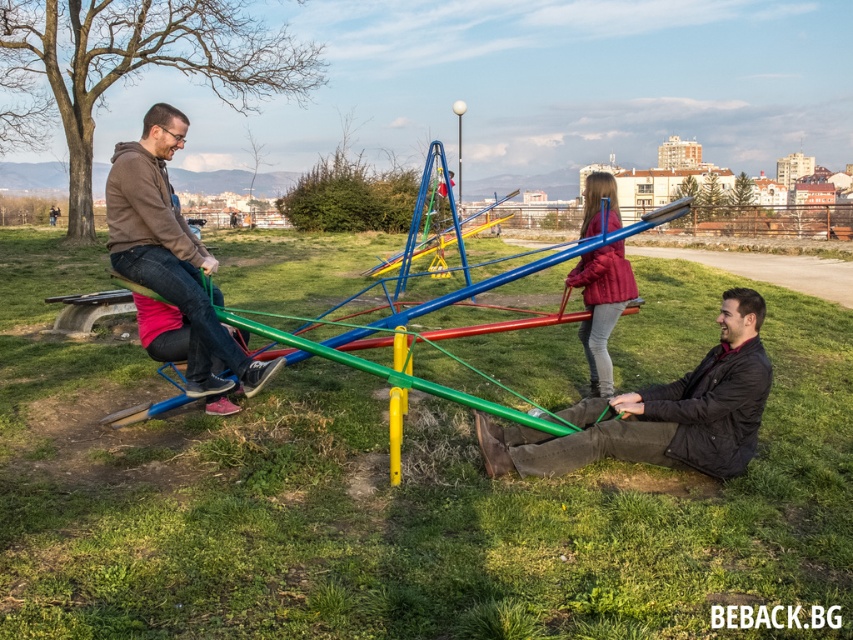
Between black leather jacket at lower right and metallic blue pole at center, which one is positioned lower?

black leather jacket at lower right

Who is higher up, black leather jacket at lower right or metallic blue pole at center?

metallic blue pole at center is above.

Between point (718, 353) and point (462, 104), which one is positioned behind?

The point (462, 104) is more distant.

Find the location of `black leather jacket at lower right`. black leather jacket at lower right is located at coordinates (659, 412).

Can you confirm if matte brown jacket at left is bigger than metallic blue pole at center?

No, matte brown jacket at left is not bigger than metallic blue pole at center.

What do you see at coordinates (172, 257) in the screenshot? I see `matte brown jacket at left` at bounding box center [172, 257].

At what (x,y) coordinates should I click in order to perform the action: click on matte brown jacket at left. Please return your answer as a coordinate pair (x, y). The image size is (853, 640). Looking at the image, I should click on (172, 257).

Can you confirm if matte brown jacket at left is positioned below velvet red coat at center?

Actually, matte brown jacket at left is above velvet red coat at center.

Looking at this image, between matte brown jacket at left and velvet red coat at center, which one has less height?

velvet red coat at center is shorter.

Where is `matte brown jacket at left`? The width and height of the screenshot is (853, 640). matte brown jacket at left is located at coordinates (172, 257).

The width and height of the screenshot is (853, 640). I want to click on matte brown jacket at left, so click(x=172, y=257).